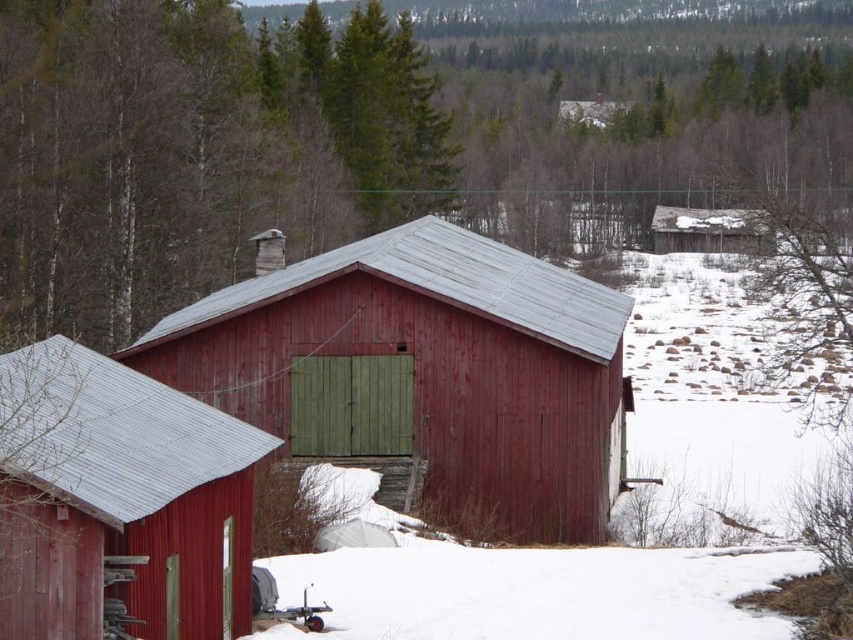
Question: Is white powdery snow at lower center to the right of weathered wooden hut at upper right from the viewer's perspective?

Choices:
 (A) no
 (B) yes

Answer: (A)

Question: Which of the following is the closest to the observer?

Choices:
 (A) click(346, 552)
 (B) click(555, 364)
 (C) click(701, 246)

Answer: (A)

Question: In this image, where is white powdery snow at lower center located relative to weathered wooden hut at upper right?

Choices:
 (A) above
 (B) below

Answer: (B)

Question: Which object is closer to the camera taking this photo?

Choices:
 (A) matte red barn at left
 (B) white powdery snow at lower center

Answer: (A)

Question: Can you confirm if smooth wooden barn at center is thinner than white powdery snow at lower center?

Choices:
 (A) yes
 (B) no

Answer: (B)

Question: Which object is farther from the camera taking this photo?

Choices:
 (A) white powdery snow at lower center
 (B) matte red barn at left
 (C) smooth wooden barn at center

Answer: (C)